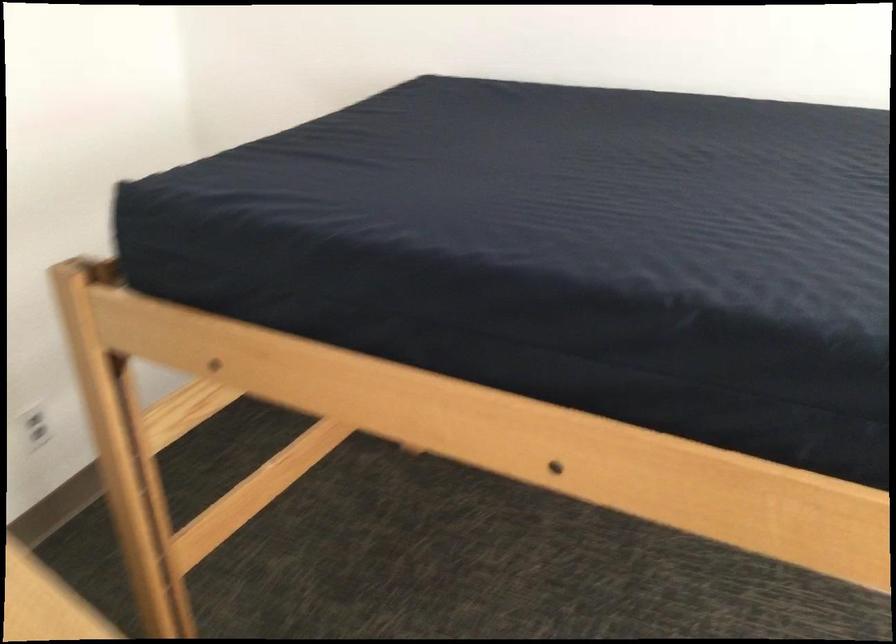
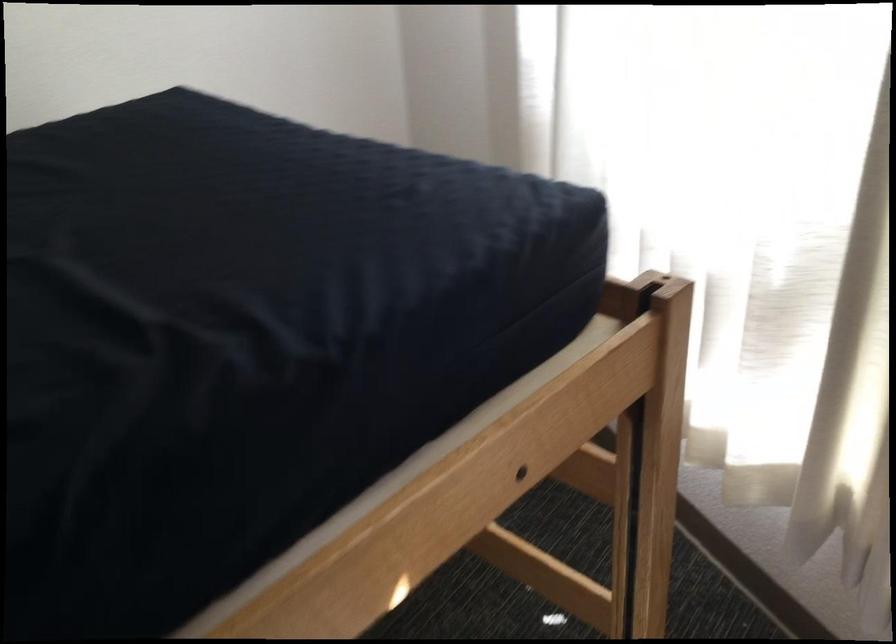
The images are taken continuously from a first-person perspective. In which direction is your viewpoint rotating?

The rotation direction of the camera is right-down.